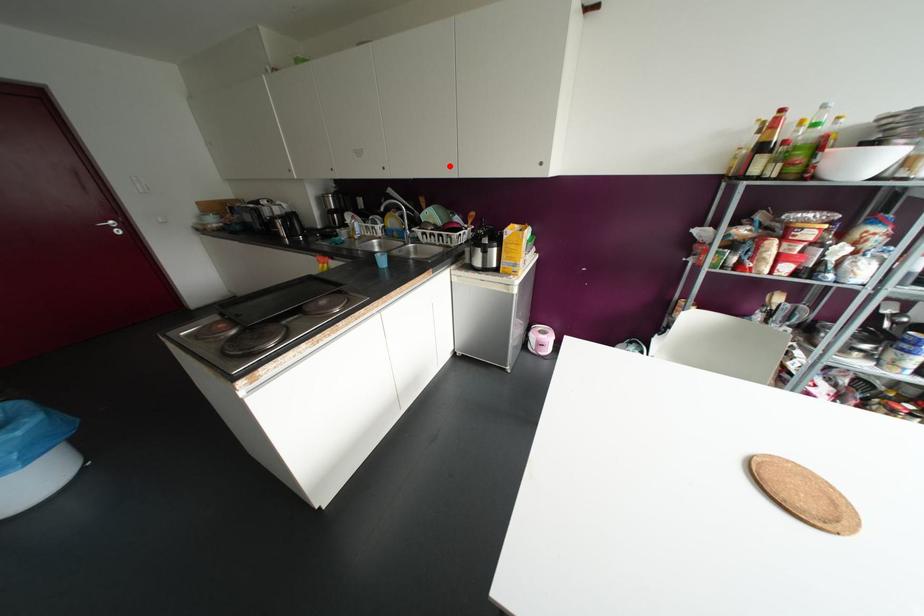
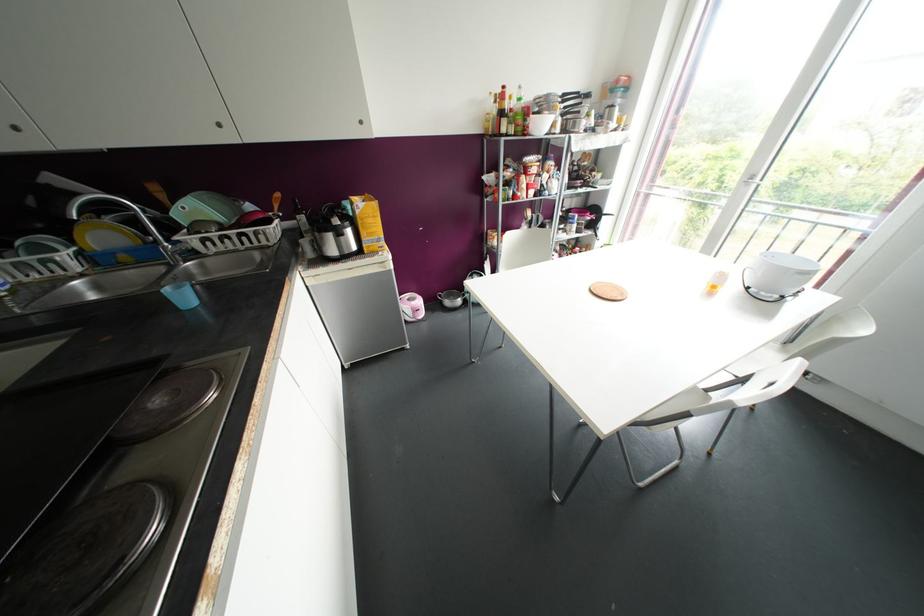
Question: I am providing you with two images of the same scene from different viewpoints. Given a red point in image1, look at the same physical point in image2. Is it:

Choices:
 (A) Closer to the viewpoint
 (B) Farther from the viewpoint

Answer: (B)